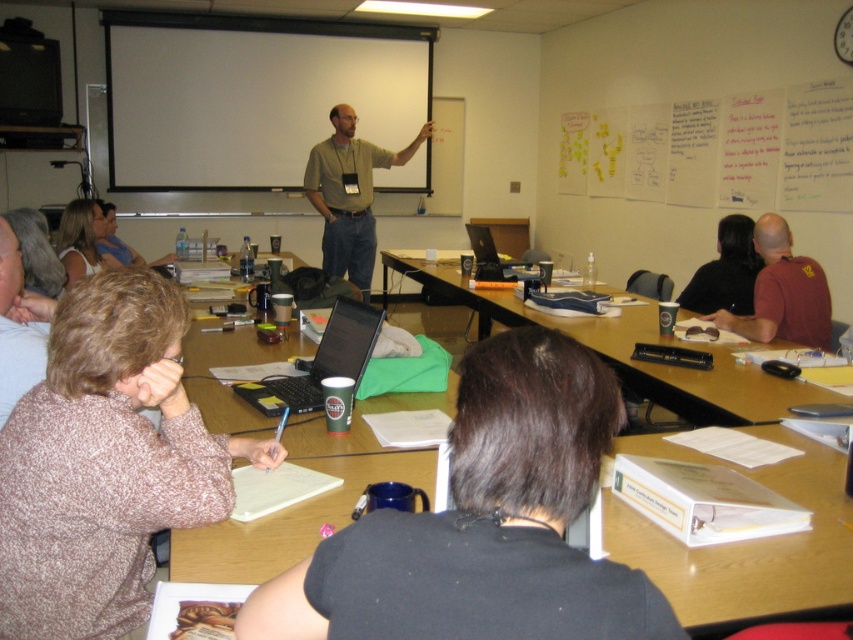
Question: Which object is positioned farthest from the wooden table at center?

Choices:
 (A) matte khaki shirt at center
 (B) black plastic laptop at center
 (C) brown leather shirt at right
 (D) white paper at upper center

Answer: (D)

Question: Which object is closer to the camera taking this photo?

Choices:
 (A) brown leather shirt at right
 (B) matte white blouse at upper left
 (C) matte khaki shirt at center

Answer: (A)

Question: Does white paper at upper center appear over shiny black laptop at center?

Choices:
 (A) yes
 (B) no

Answer: (A)

Question: Among these points, which one is nearest to the camera?

Choices:
 (A) (596, 339)
 (B) (721, 173)

Answer: (A)

Question: Is white paper at upper center thinner than matte white blouse at upper left?

Choices:
 (A) no
 (B) yes

Answer: (A)

Question: Can you confirm if wooden table at center is positioned to the right of black plastic laptop at center?

Choices:
 (A) yes
 (B) no

Answer: (A)